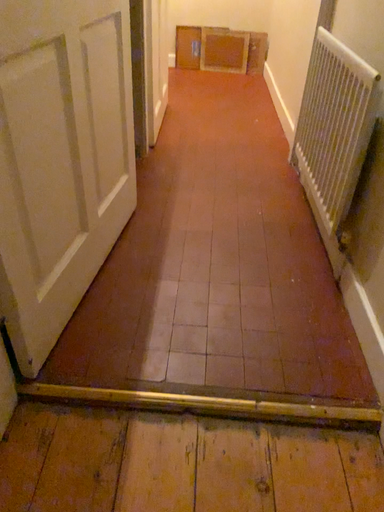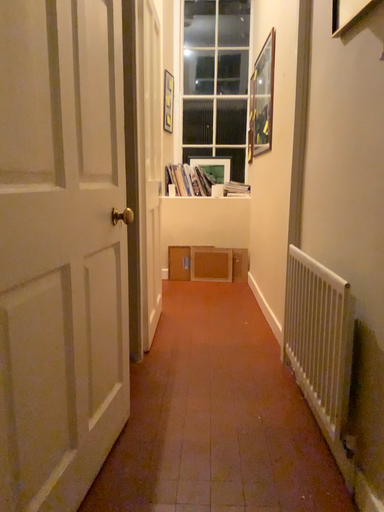
Question: Which way did the camera rotate in the video?

Choices:
 (A) rotated upward
 (B) rotated downward

Answer: (A)